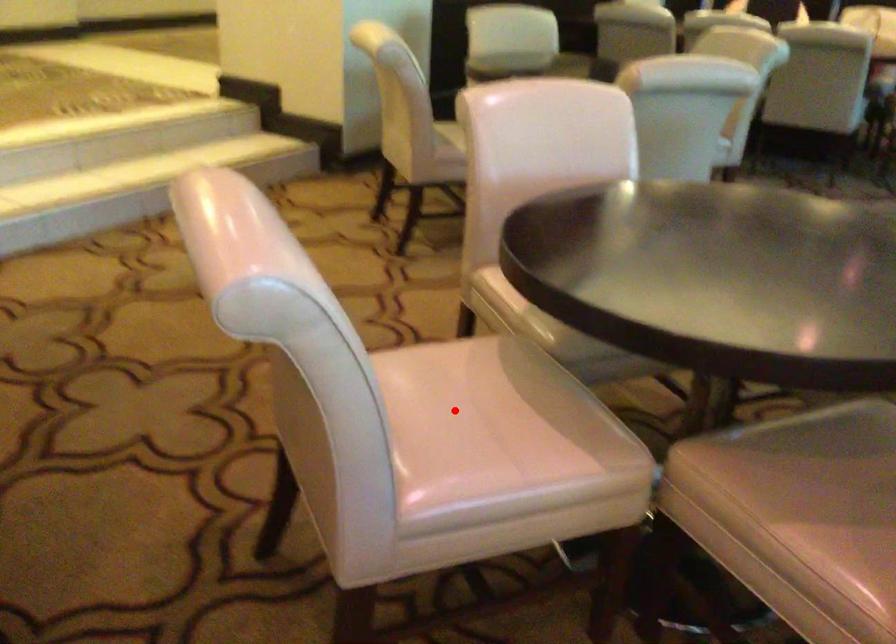
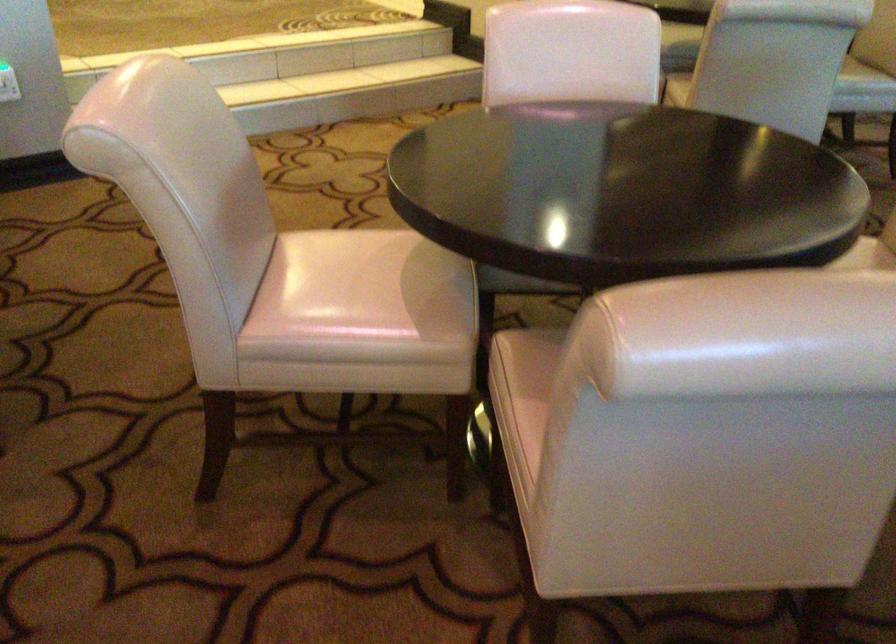
Where in the second image is the point corresponding to the highlighted location from the first image?

(347, 278)